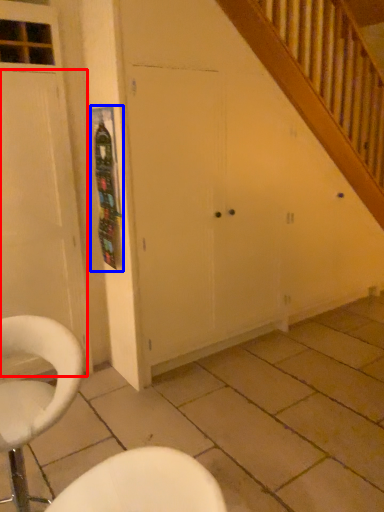
Question: Which of the following is the farthest to the observer, door (highlighted by a red box) or bulletin board (highlighted by a blue box)?

Choices:
 (A) door
 (B) bulletin board

Answer: (B)